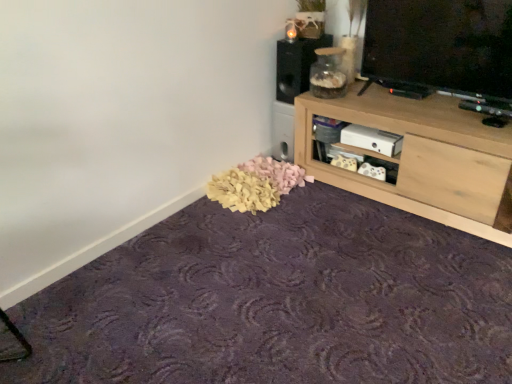
The image size is (512, 384). What do you see at coordinates (278, 301) in the screenshot?
I see `purple textured carpet at lower center` at bounding box center [278, 301].

What are the coordinates of `transparent glass jar at upper right` in the screenshot? It's located at (328, 74).

From the image's perspective, which object appears higher, black matte speaker at upper center or transparent glass jar at upper right?

black matte speaker at upper center.

In the scene shown: Considering the relative sizes of black matte speaker at upper center and transparent glass jar at upper right in the image provided, is black matte speaker at upper center wider than transparent glass jar at upper right?

Correct, the width of black matte speaker at upper center exceeds that of transparent glass jar at upper right.

Considering the positions of objects black matte speaker at upper center and transparent glass jar at upper right in the image provided, who is more to the right, black matte speaker at upper center or transparent glass jar at upper right?

transparent glass jar at upper right.

Can you confirm if transparent glass jar at upper right is wider than purple textured carpet at lower center?

No, transparent glass jar at upper right is not wider than purple textured carpet at lower center.

Which object is positioned more to the right, transparent glass jar at upper right or purple textured carpet at lower center?

Positioned to the right is transparent glass jar at upper right.

The image size is (512, 384). Identify the location of glass jar on the right of the purple textured carpet at lower center. (328, 74).

Is transparent glass jar at upper right touching purple textured carpet at lower center?

No, transparent glass jar at upper right is not touching purple textured carpet at lower center.

Is transparent glass jar at upper right not inside black matte speaker at upper center?

transparent glass jar at upper right is positioned outside black matte speaker at upper center.

From the picture: Between transparent glass jar at upper right and black matte speaker at upper center, which one has smaller width?

transparent glass jar at upper right is thinner.

Looking at this image, from the image's perspective, is transparent glass jar at upper right positioned above or below black matte speaker at upper center?

transparent glass jar at upper right is below black matte speaker at upper center.

How far apart are transparent glass jar at upper right and black matte speaker at upper center?

transparent glass jar at upper right is 6.15 inches from black matte speaker at upper center.

Is light wood shelf at upper right far from black matte speaker at upper center?

They are positioned close to each other.

Is black matte speaker at upper center inside light wood shelf at upper right?

No, black matte speaker at upper center is not inside light wood shelf at upper right.

From the image's perspective, is light wood shelf at upper right above or below black matte speaker at upper center?

From the image's perspective, light wood shelf at upper right appears below black matte speaker at upper center.

Considering the sizes of light wood shelf at upper right and purple textured carpet at lower center in the image, is light wood shelf at upper right bigger or smaller than purple textured carpet at lower center?

Considering their sizes, light wood shelf at upper right takes up more space than purple textured carpet at lower center.

Which is in front, point (413, 127) or point (399, 319)?

Positioned in front is point (399, 319).

In terms of width, does light wood shelf at upper right look wider or thinner when compared to purple textured carpet at lower center?

Clearly, light wood shelf at upper right has less width compared to purple textured carpet at lower center.

Is light wood shelf at upper right at the left side of purple textured carpet at lower center?

In fact, light wood shelf at upper right is to the right of purple textured carpet at lower center.

From a real-world perspective, is purple textured carpet at lower center physically above black matte speaker at upper center?

Incorrect, from a real-world perspective, purple textured carpet at lower center is lower than black matte speaker at upper center.

Are purple textured carpet at lower center and black matte speaker at upper center far apart?

That's right, there is a large distance between purple textured carpet at lower center and black matte speaker at upper center.

Is purple textured carpet at lower center aimed at black matte speaker at upper center?

No, purple textured carpet at lower center is not facing towards black matte speaker at upper center.

Between purple textured carpet at lower center and black matte speaker at upper center, which one appears on the right side from the viewer's perspective?

From the viewer's perspective, black matte speaker at upper center appears more on the right side.

Is light wood shelf at upper right to the left or to the right of transparent glass jar at upper right in the image?

light wood shelf at upper right is to the right of transparent glass jar at upper right.

Is transparent glass jar at upper right at the back of light wood shelf at upper right?

No, light wood shelf at upper right's orientation is not away from transparent glass jar at upper right.

Based on the photo, is transparent glass jar at upper right inside light wood shelf at upper right?

No, transparent glass jar at upper right is located outside of light wood shelf at upper right.

This screenshot has width=512, height=384. In order to click on glass jar in front of the black matte speaker at upper center in this screenshot , I will do `click(328, 74)`.

Where is `plain located on the left of transparent glass jar at upper right`? The height and width of the screenshot is (384, 512). plain located on the left of transparent glass jar at upper right is located at coordinates (278, 301).

Which object lies further to the anchor point light wood shelf at upper right, purple textured carpet at lower center or black matte speaker at upper center?

purple textured carpet at lower center.

Which object lies further to the anchor point black matte speaker at upper center, light wood shelf at upper right or transparent glass jar at upper right?

light wood shelf at upper right is further to black matte speaker at upper center.

Based on their spatial positions, is transparent glass jar at upper right or light wood shelf at upper right closer to black matte speaker at upper center?

transparent glass jar at upper right lies closer to black matte speaker at upper center than the other object.

Looking at the image, which one is located further to light wood shelf at upper right, transparent glass jar at upper right or black matte speaker at upper center?

The object further to light wood shelf at upper right is black matte speaker at upper center.

Estimate the real-world distances between objects in this image. Which object is closer to transparent glass jar at upper right, black matte speaker at upper center or light wood shelf at upper right?

black matte speaker at upper center is closer to transparent glass jar at upper right.

Looking at the image, which one is located further to black matte speaker at upper center, transparent glass jar at upper right or purple textured carpet at lower center?

The object further to black matte speaker at upper center is purple textured carpet at lower center.

Considering their positions, is transparent glass jar at upper right positioned closer to purple textured carpet at lower center than black matte speaker at upper center?

Based on the image, transparent glass jar at upper right appears to be nearer to purple textured carpet at lower center.

Based on their spatial positions, is purple textured carpet at lower center or light wood shelf at upper right further from black matte speaker at upper center?

The object further to black matte speaker at upper center is purple textured carpet at lower center.

I want to click on shelf positioned between purple textured carpet at lower center and transparent glass jar at upper right from near to far, so click(422, 158).

Find the location of `glass jar positioned between purple textured carpet at lower center and black matte speaker at upper center from near to far`. glass jar positioned between purple textured carpet at lower center and black matte speaker at upper center from near to far is located at coordinates (328, 74).

Identify the location of glass jar between light wood shelf at upper right and black matte speaker at upper center from front to back. The width and height of the screenshot is (512, 384). (328, 74).

Where is `shelf between purple textured carpet at lower center and black matte speaker at upper center from front to back`? Image resolution: width=512 pixels, height=384 pixels. shelf between purple textured carpet at lower center and black matte speaker at upper center from front to back is located at coordinates (422, 158).